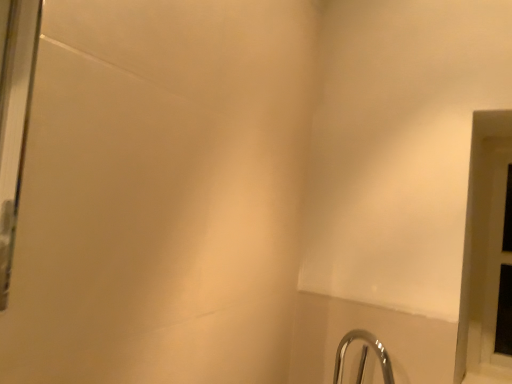
Question: Should I look upward or downward to see white plastic window frame at right?

Choices:
 (A) down
 (B) up

Answer: (A)